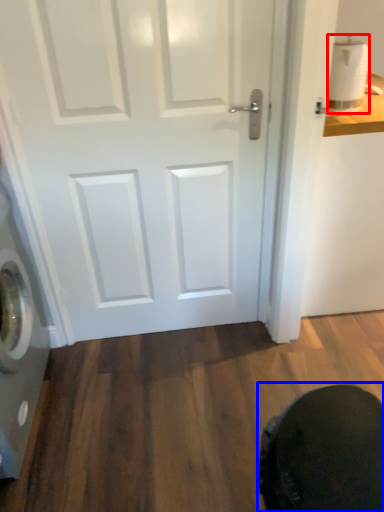
Question: Which point is further to the camera, toilet paper (highlighted by a red box) or swivel chair (highlighted by a blue box)?

Choices:
 (A) toilet paper
 (B) swivel chair

Answer: (A)